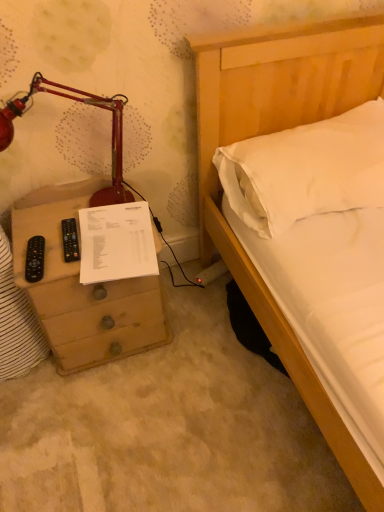
You are a GUI agent. You are given a task and a screenshot of the screen. Output one action in this format:
    pyautogui.click(x=<x>, y=<y>)
    Task: Click on the free space that is in between black plastic remote at left and black plastic remote at left
    This screenshot has height=512, width=384.
    Given the screenshot: What is the action you would take?
    (x=53, y=254)